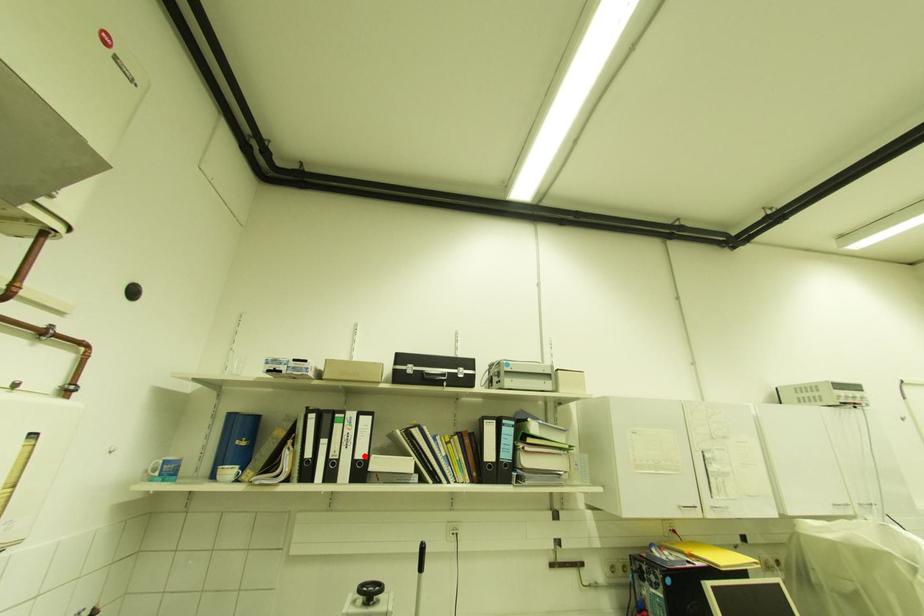
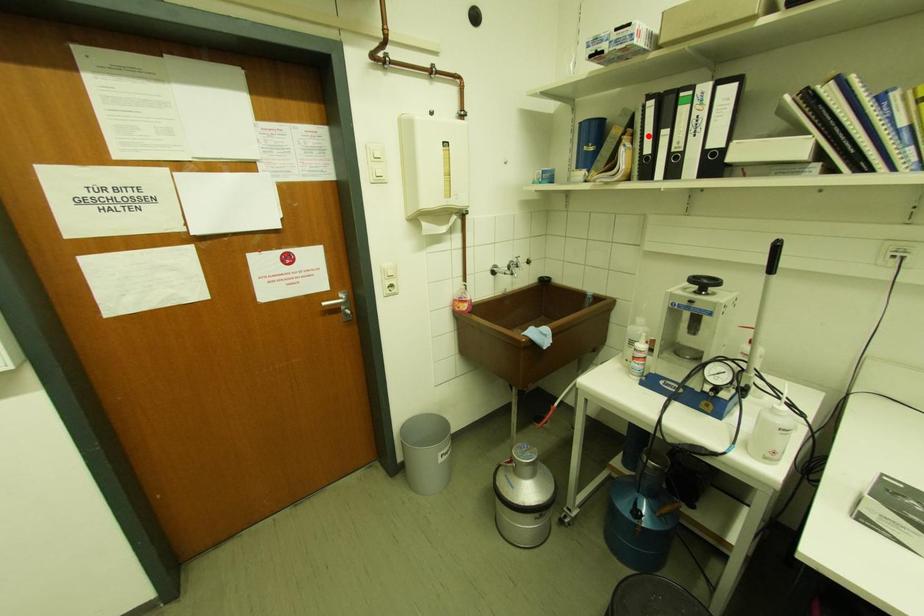
I am providing you with two images of the same scene from different viewpoints. A red point is marked on the first image and another point is marked on the second image. Is the red point in image1 aligned with the point shown in image2?

→ No